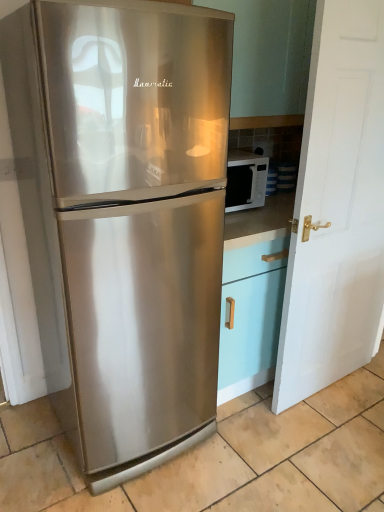
At what (x,y) coordinates should I click in order to perform the action: click on free location in front of white glossy microwave at right. Please return your answer as a coordinate pair (x, y). Looking at the image, I should click on (241, 222).